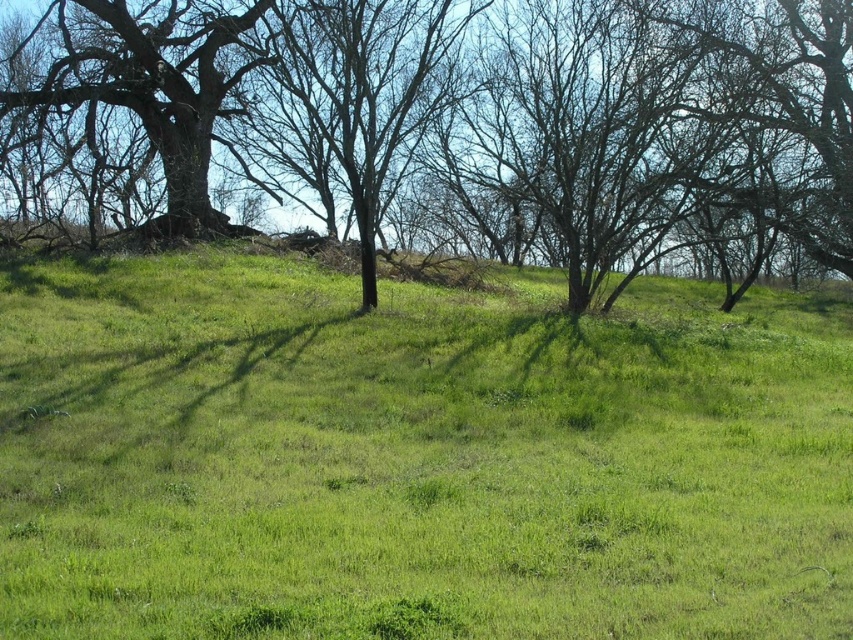
You are a hiker trying to determine which tree to use as a landmark. The brown rough bark tree at upper left and the smooth bark tree at left are both visible. Which tree has a wider trunk?

The brown rough bark tree at upper left has a wider trunk than the smooth bark tree at left because its width is larger according to the description.

Based on the photo, you are standing at the origin point of the image. Where is the green grassy hillside at center located in terms of coordinates?

The green grassy hillside at center is located at coordinates point (413, 458).